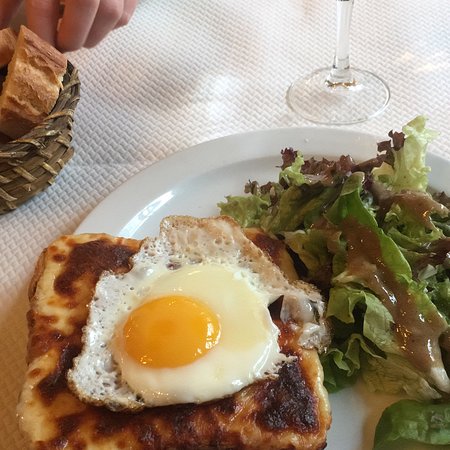
Locate an element on the screen. This screenshot has height=450, width=450. plate is located at coordinates (103, 225).